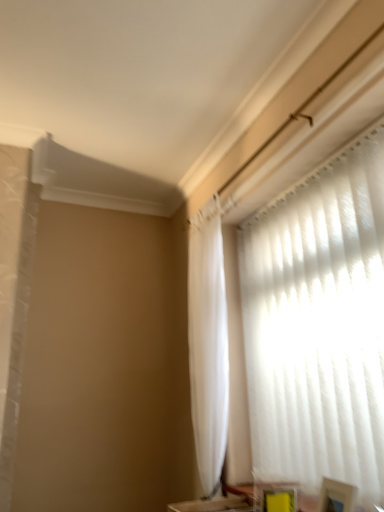
Question: Should I look upward or downward to see white sheer curtain at upper right?

Choices:
 (A) up
 (B) down

Answer: (B)